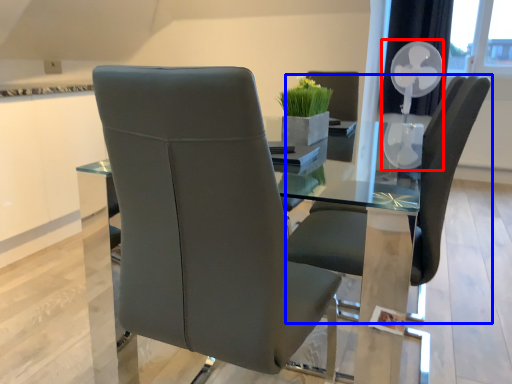
Question: Which of the following is the closest to the observer, fan (highlighted by a red box) or chair (highlighted by a blue box)?

Choices:
 (A) fan
 (B) chair

Answer: (B)